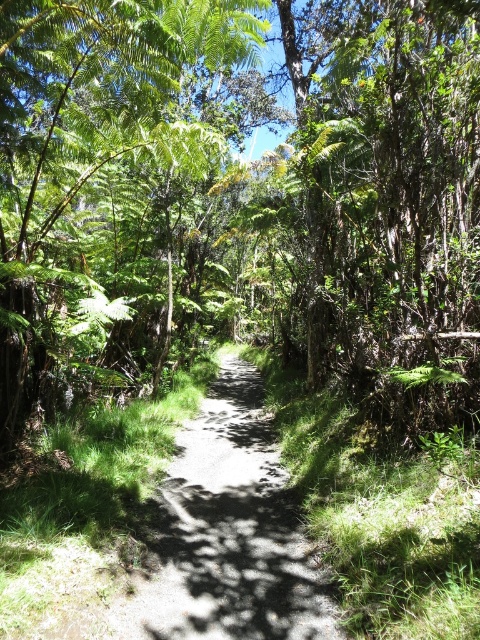
You are hiking along the dirt path at center and want to take a photo of the green leafy tree at center. Since the tree is blocking the sunlight, will the photo be taken in a bright or dark area?

The green leafy tree at center is above the dirt path at center, so the area under the tree might be darker due to the shade it casts. Therefore, the photo taken there would likely be in a dark area.

You are standing at the entrance of the forest path and want to locate the green leafy tree at center. According to the coordinates provided, where should you look relative to your current position?

The green leafy tree at center is located at coordinates point (x=239, y=184), which means it is positioned slightly to the left and forward from your current position at the entrance.